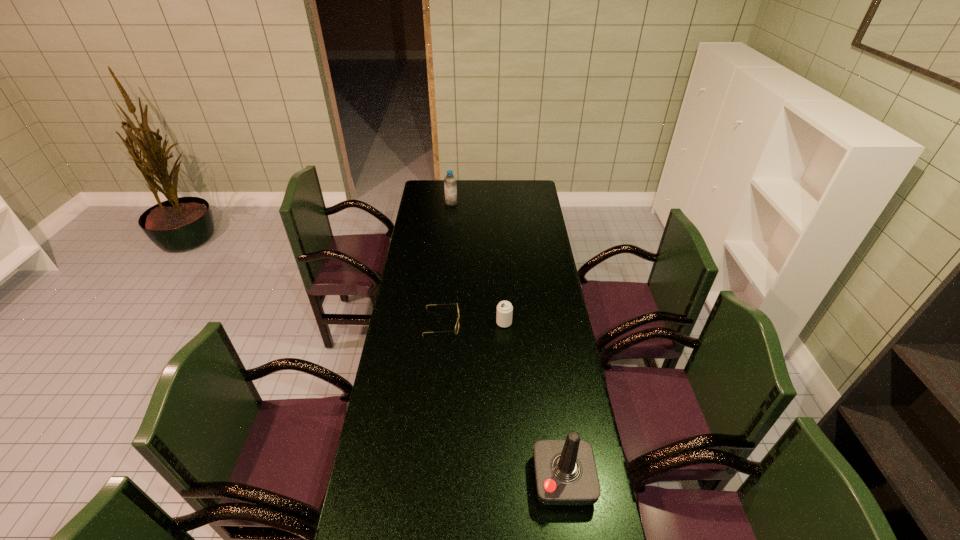
Identify the location of free spot that satisfies the following two spatial constraints: 1. on the front-facing side of the third object from left to right; 2. on the left side of the shortest object. This screenshot has height=540, width=960. (442, 323).

Where is `free region that satisfies the following two spatial constraints: 1. on the back side of the can; 2. on the front-facing side of the spectacles`? Image resolution: width=960 pixels, height=540 pixels. free region that satisfies the following two spatial constraints: 1. on the back side of the can; 2. on the front-facing side of the spectacles is located at coordinates (504, 322).

You are a GUI agent. You are given a task and a screenshot of the screen. Output one action in this format:
    pyautogui.click(x=<x>, y=<y>)
    Task: Click on the free space in the image that satisfies the following two spatial constraints: 1. on the front-facing side of the spectacles; 2. on the left side of the can
    
    Given the screenshot: What is the action you would take?
    pyautogui.click(x=442, y=323)

Where is `vacant space that satisfies the following two spatial constraints: 1. on the front side of the tallest object; 2. on the right side of the farthest object`? The image size is (960, 540). vacant space that satisfies the following two spatial constraints: 1. on the front side of the tallest object; 2. on the right side of the farthest object is located at coordinates (425, 480).

Where is `free space that satisfies the following two spatial constraints: 1. on the front-facing side of the spectacles; 2. on the right side of the second object from right to left`? This screenshot has height=540, width=960. free space that satisfies the following two spatial constraints: 1. on the front-facing side of the spectacles; 2. on the right side of the second object from right to left is located at coordinates (x=442, y=323).

Locate an element on the screen. vacant position in the image that satisfies the following two spatial constraints: 1. on the front-facing side of the second shortest object; 2. on the right side of the shortest object is located at coordinates (442, 323).

The image size is (960, 540). In order to click on vacant space that satisfies the following two spatial constraints: 1. on the front-facing side of the second shortest object; 2. on the right side of the shortest object in this screenshot , I will do `click(442, 323)`.